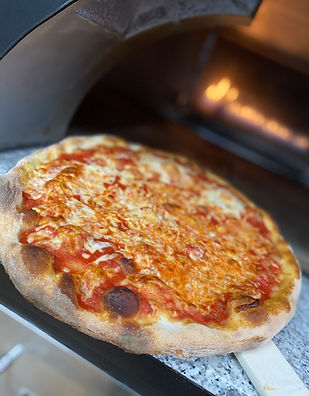
Where is `marble countertop`? This screenshot has width=309, height=396. marble countertop is located at coordinates (222, 374).